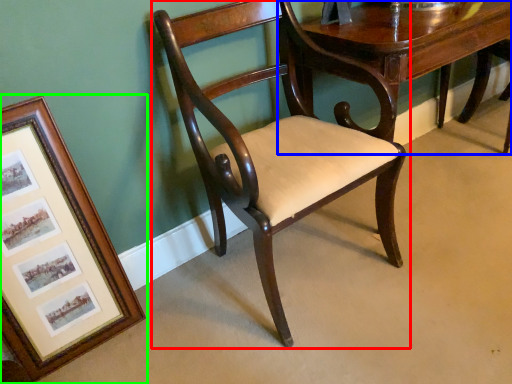
Question: Considering the real-world distances, which object is farthest from chair (highlighted by a red box)? table (highlighted by a blue box) or picture frame (highlighted by a green box)?

Choices:
 (A) table
 (B) picture frame

Answer: (B)